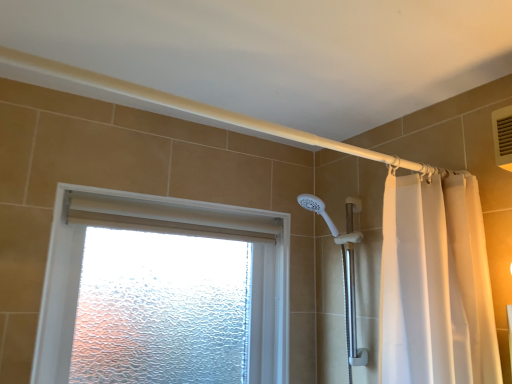
Where is `frosted glass window at upper center`? The width and height of the screenshot is (512, 384). frosted glass window at upper center is located at coordinates (168, 233).

Image resolution: width=512 pixels, height=384 pixels. What do you see at coordinates (168, 233) in the screenshot? I see `frosted glass window at upper center` at bounding box center [168, 233].

At what (x,y) coordinates should I click in order to perform the action: click on frosted glass window at upper center. Please return your answer as a coordinate pair (x, y). The image size is (512, 384). Looking at the image, I should click on (168, 233).